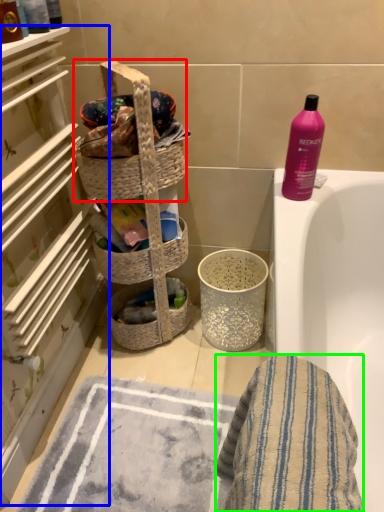
Question: Based on their relative distances, which object is nearer to picnic basket (highlighted by a red box)? Choose from shelf (highlighted by a blue box) and bath towel (highlighted by a green box).

Choices:
 (A) shelf
 (B) bath towel

Answer: (A)